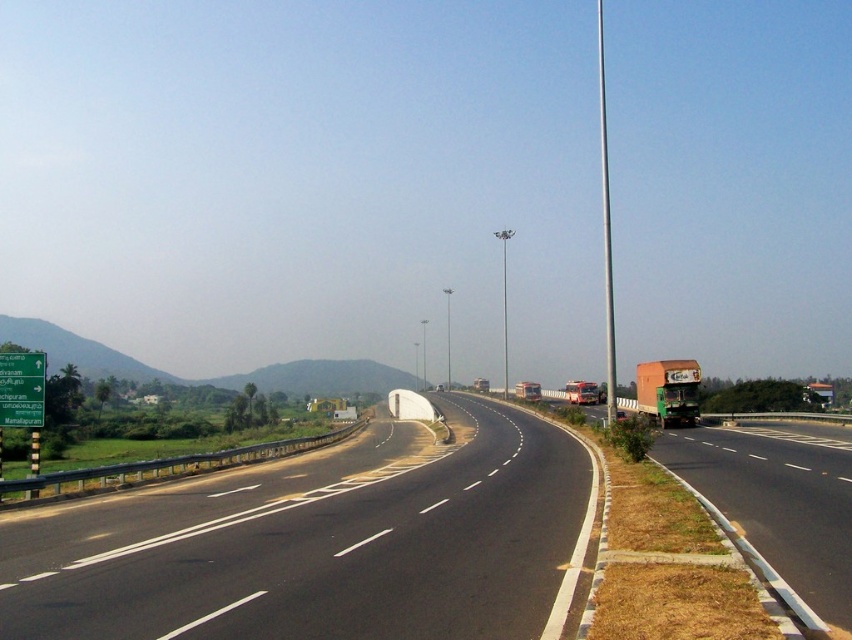
Does green plastic sign at upper left have a greater width compared to silver metallic pole at right?

Incorrect, green plastic sign at upper left's width does not surpass silver metallic pole at right's.

Looking at this image, does green plastic sign at upper left have a smaller size compared to silver metallic pole at right?

Correct, green plastic sign at upper left occupies less space than silver metallic pole at right.

Locate an element on the screen. green plastic sign at upper left is located at coordinates (21, 388).

Between black asphalt highway at center and orange matte trailer truck at right, which one has more height?

With more height is black asphalt highway at center.

Is point (446, 472) positioned in front of point (658, 412)?

Yes, point (446, 472) is closer to viewer.

The height and width of the screenshot is (640, 852). I want to click on black asphalt highway at center, so click(x=321, y=545).

Can you confirm if orange matte trailer truck at right is shorter than green plastic sign at upper left?

In fact, orange matte trailer truck at right may be taller than green plastic sign at upper left.

Who is taller, orange matte trailer truck at right or green plastic sign at upper left?

With more height is orange matte trailer truck at right.

The height and width of the screenshot is (640, 852). What are the coordinates of `orange matte trailer truck at right` in the screenshot? It's located at (668, 392).

Locate an element on the screen. This screenshot has height=640, width=852. orange matte trailer truck at right is located at coordinates (668, 392).